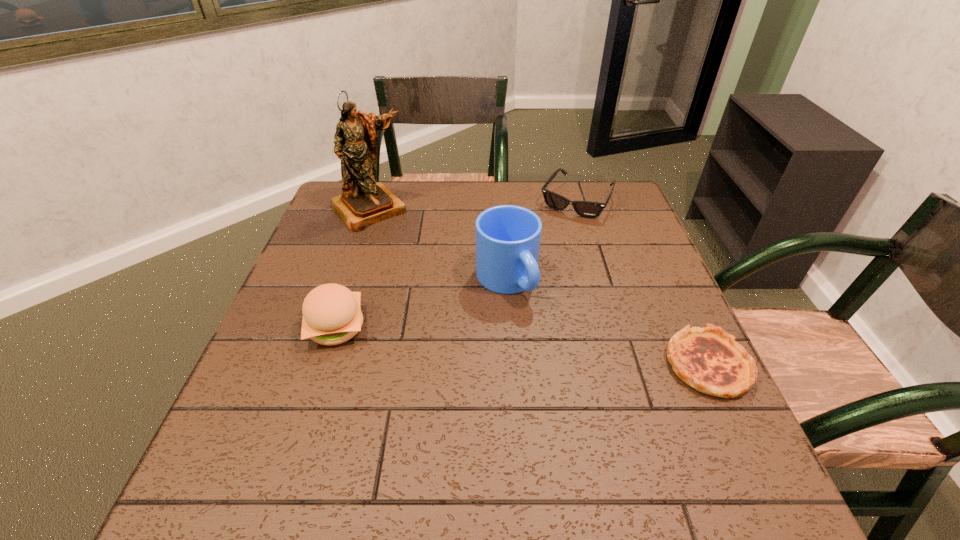
You are a GUI agent. You are given a task and a screenshot of the screen. Output one action in this format:
    pyautogui.click(x=<x>, y=<y>)
    Task: Click on the hamburger
    
    Given the screenshot: What is the action you would take?
    pyautogui.click(x=332, y=315)

At what (x,y) coordinates should I click in order to perform the action: click on quiche. Please return your answer as a coordinate pair (x, y). This screenshot has height=540, width=960. Looking at the image, I should click on (708, 359).

Where is `figurine`? figurine is located at coordinates (364, 202).

Image resolution: width=960 pixels, height=540 pixels. What are the coordinates of `mug` in the screenshot? It's located at (508, 237).

The width and height of the screenshot is (960, 540). Identify the location of the third object from right to left. (508, 237).

Find the location of a particular element. The height and width of the screenshot is (540, 960). sunglasses is located at coordinates (587, 209).

Locate an element on the screen. This screenshot has height=540, width=960. blank area located 0.310m on the back of the third tallest object is located at coordinates (369, 226).

The image size is (960, 540). Identify the location of vacant area situated 0.330m on the left of the shortest object. (504, 364).

In order to click on vacant space located 0.090m on the front-facing side of the figurine in this screenshot , I will do `click(400, 244)`.

Where is `free location located 0.160m on the front-facing side of the figurine`? free location located 0.160m on the front-facing side of the figurine is located at coordinates (413, 258).